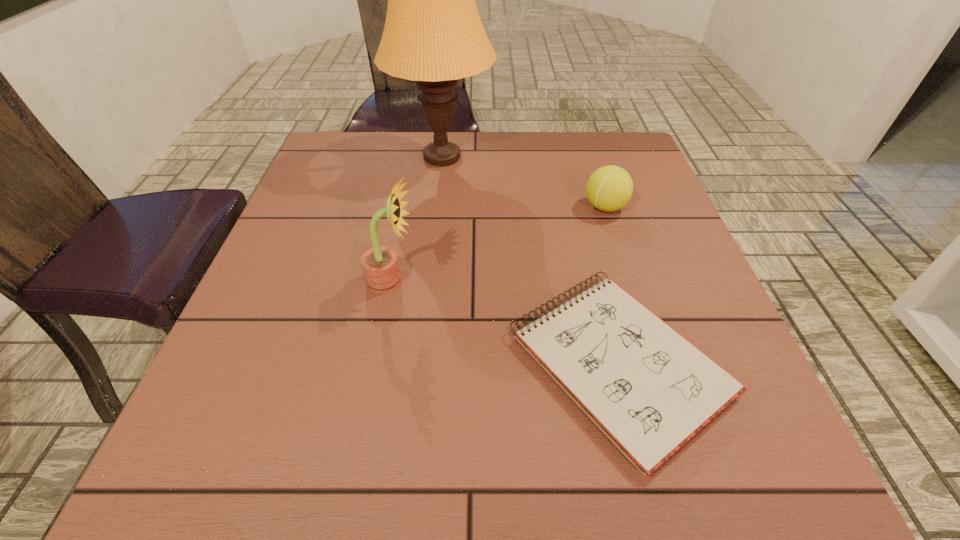
Where is `the tallest object`? The height and width of the screenshot is (540, 960). the tallest object is located at coordinates (433, 34).

Locate an element on the screen. This screenshot has height=540, width=960. the farthest object is located at coordinates (433, 34).

Where is `the second tallest object`? The width and height of the screenshot is (960, 540). the second tallest object is located at coordinates (380, 266).

The image size is (960, 540). Find the location of `tennis ball`. tennis ball is located at coordinates (609, 188).

Identify the location of the second farthest object. (609, 188).

The height and width of the screenshot is (540, 960). Identify the location of notepad. (650, 390).

You are a GUI agent. You are given a task and a screenshot of the screen. Output one action in this format:
    pyautogui.click(x=<x>, y=<y>)
    Task: Click on the vacant region located on the front of the tallest object
    Image resolution: width=960 pixels, height=540 pixels.
    Given the screenshot: What is the action you would take?
    pyautogui.click(x=428, y=281)

The width and height of the screenshot is (960, 540). Identify the location of blank space located on the face of the sunflower. (488, 281).

What are the coordinates of `blank space located on the left of the tennis ball` in the screenshot? It's located at (506, 207).

What are the coordinates of `vacant region located on the back of the shortest object` in the screenshot? It's located at (592, 259).